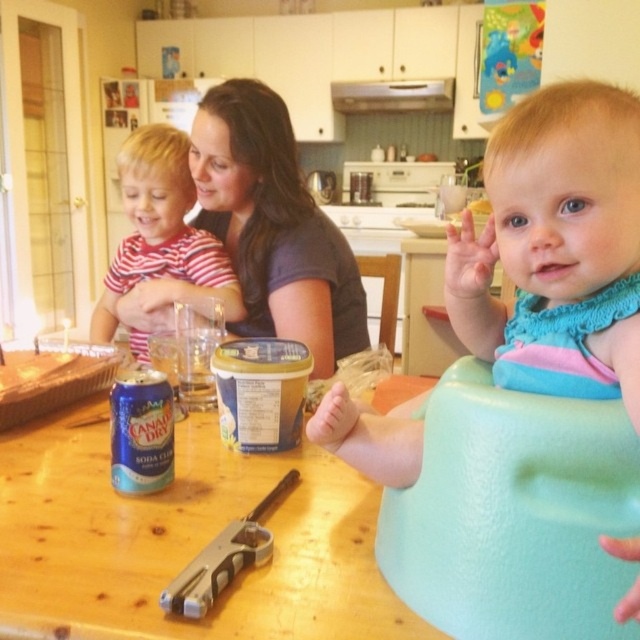
Does wooden table at center appear on the right side of matte striped shirt at center?

Yes, wooden table at center is to the right of matte striped shirt at center.

Is wooden table at center closer to the viewer compared to matte striped shirt at center?

That is True.

Is point (67, 515) less distant than point (202, 240)?

Yes, point (67, 515) is closer to viewer.

Find the location of a particular element. The width and height of the screenshot is (640, 640). wooden table at center is located at coordinates point(182,540).

Does silver metallic toy gun at center appear over wooden chair at center?

No.

Identify the location of silver metallic toy gun at center. The image size is (640, 640). (224, 557).

Does dark brown hair at upper center appear over silver metallic toy gun at center?

Yes.

Does dark brown hair at upper center have a larger size compared to silver metallic toy gun at center?

Yes, dark brown hair at upper center is bigger than silver metallic toy gun at center.

Who is more distant from viewer, (x=289, y=268) or (x=177, y=605)?

Point (x=289, y=268)

Where is `dark brown hair at upper center`? The image size is (640, 640). dark brown hair at upper center is located at coordinates (273, 225).